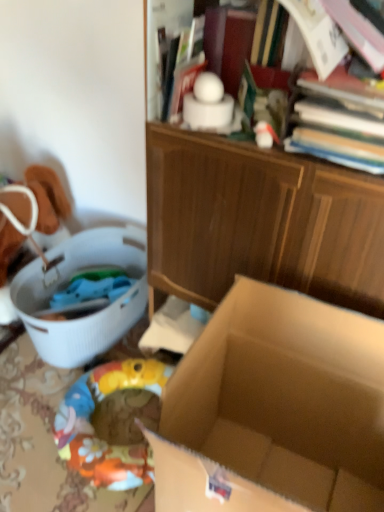
Question: Can you confirm if white plastic laundry basket at left is positioned to the right of brown cardboard box at center?

Choices:
 (A) yes
 (B) no

Answer: (B)

Question: From the image's perspective, does white plastic laundry basket at left appear higher than brown cardboard box at center?

Choices:
 (A) yes
 (B) no

Answer: (A)

Question: Is white plastic laundry basket at left to the left of brown cardboard box at center from the viewer's perspective?

Choices:
 (A) yes
 (B) no

Answer: (A)

Question: Is white plastic laundry basket at left further to camera compared to brown cardboard box at center?

Choices:
 (A) yes
 (B) no

Answer: (A)

Question: Are white plastic laundry basket at left and brown cardboard box at center located far from each other?

Choices:
 (A) yes
 (B) no

Answer: (B)

Question: Is white plastic laundry basket at left wider or thinner than brown cardboard box at center?

Choices:
 (A) thin
 (B) wide

Answer: (B)

Question: From a real-world perspective, is white plastic laundry basket at left above or below brown cardboard box at center?

Choices:
 (A) below
 (B) above

Answer: (A)

Question: Is white plastic laundry basket at left in front of or behind brown cardboard box at center in the image?

Choices:
 (A) front
 (B) behind

Answer: (B)

Question: Is point (82, 342) closer or farther from the camera than point (266, 353)?

Choices:
 (A) farther
 (B) closer

Answer: (A)

Question: From a real-world perspective, is brown cardboard box at center physically located above or below hardcover book at upper right?

Choices:
 (A) above
 (B) below

Answer: (B)

Question: From the image's perspective, is brown cardboard box at center located above or below hardcover book at upper right?

Choices:
 (A) below
 (B) above

Answer: (A)

Question: In terms of height, does brown cardboard box at center look taller or shorter compared to hardcover book at upper right?

Choices:
 (A) short
 (B) tall

Answer: (B)

Question: In terms of width, does brown cardboard box at center look wider or thinner when compared to hardcover book at upper right?

Choices:
 (A) thin
 (B) wide

Answer: (B)

Question: Is hardcover book at upper right in front of or behind brown cardboard box at center in the image?

Choices:
 (A) behind
 (B) front

Answer: (A)

Question: From a real-world perspective, is hardcover book at upper right physically located above or below brown cardboard box at center?

Choices:
 (A) below
 (B) above

Answer: (B)